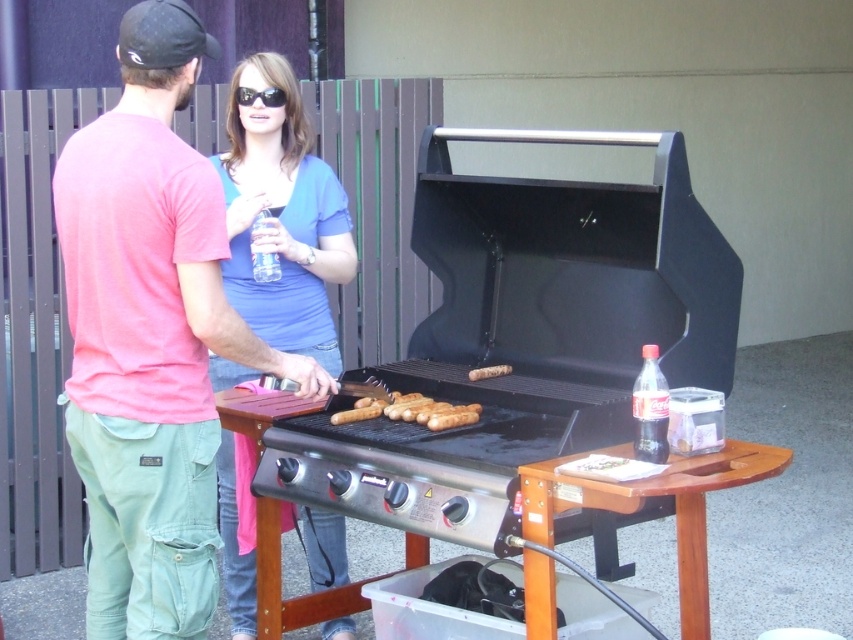
Between smooth brown hot dogs at center and clear plastic bottle at center, which one is positioned lower?

smooth brown hot dogs at center

Between point (357, 408) and point (252, 260), which one is positioned behind?

Positioned behind is point (252, 260).

Is point (421, 396) behind point (277, 273)?

No.

What are the coordinates of `smooth brown hot dogs at center` in the screenshot? It's located at (412, 412).

Which is in front, point (158, 205) or point (242, 97)?

Point (158, 205)

Who is lower down, matte pink t-shirt at center or black plastic sunglasses at center?

Positioned lower is matte pink t-shirt at center.

Locate an element on the screen. This screenshot has height=640, width=853. matte pink t-shirt at center is located at coordinates (149, 356).

Does black fabric baseball cap at upper left have a lesser height compared to clear plastic bottle at center?

Correct, black fabric baseball cap at upper left is not as tall as clear plastic bottle at center.

Is point (218, 54) farther from camera compared to point (257, 220)?

No, (218, 54) is in front of (257, 220).

You are a GUI agent. You are given a task and a screenshot of the screen. Output one action in this format:
    pyautogui.click(x=<x>, y=<y>)
    Task: Click on the black fabric baseball cap at upper left
    The image size is (853, 640).
    Given the screenshot: What is the action you would take?
    pyautogui.click(x=161, y=35)